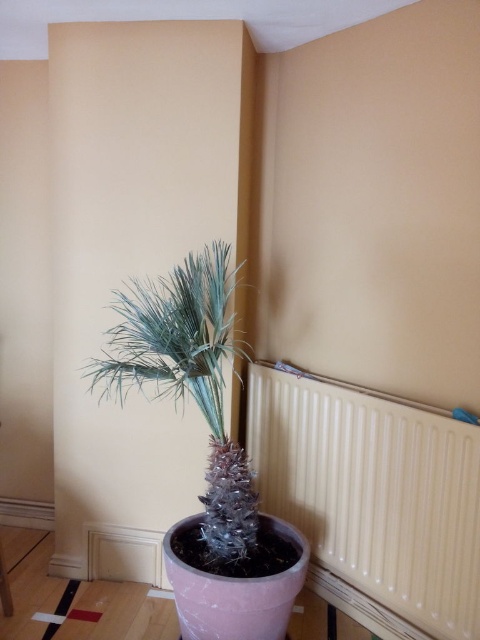
You are standing in a room and want to hang a picture on the wall behind the silvery metallic plant at center. Can you do this without moving the white textured radiator at lower right?

The white textured radiator at lower right is in front of the silvery metallic plant at center, so the radiator is blocking the wall behind the plant. You would need to move the radiator to hang the picture there.

You are a maintenance worker needing to reach the white textured radiator at lower right. You have a ladder that is 1.5 meters tall. Can you safely reach the radiator with this ladder?

The white textured radiator at lower right is 1.64 meters away from the camera. Since the ladder is only 1.5 meters tall, it is not tall enough to safely reach the radiator.